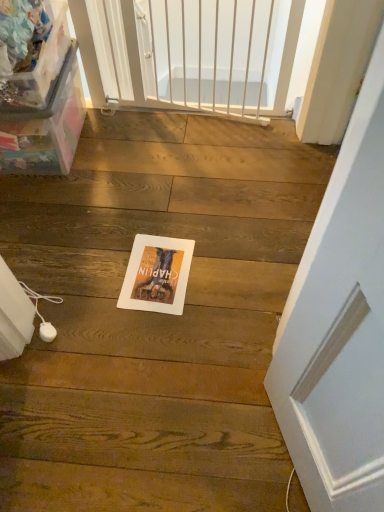
Question: Does transparent plastic box at left have a smaller size compared to matte paper postcard at center?

Choices:
 (A) yes
 (B) no

Answer: (B)

Question: Is the surface of transparent plastic box at left in direct contact with matte paper postcard at center?

Choices:
 (A) yes
 (B) no

Answer: (B)

Question: Considering the relative sizes of transparent plastic box at left and matte paper postcard at center in the image provided, is transparent plastic box at left wider than matte paper postcard at center?

Choices:
 (A) yes
 (B) no

Answer: (A)

Question: Could you tell me if transparent plastic box at left is turned towards matte paper postcard at center?

Choices:
 (A) yes
 (B) no

Answer: (B)

Question: From the image's perspective, is transparent plastic box at left over matte paper postcard at center?

Choices:
 (A) yes
 (B) no

Answer: (A)

Question: From a real-world perspective, is transparent plastic box at left located beneath matte paper postcard at center?

Choices:
 (A) yes
 (B) no

Answer: (B)

Question: Would you consider matte paper postcard at center to be distant from white metal gate at upper center?

Choices:
 (A) no
 (B) yes

Answer: (A)

Question: Does matte paper postcard at center appear on the right side of white metal gate at upper center?

Choices:
 (A) yes
 (B) no

Answer: (B)

Question: Can you confirm if matte paper postcard at center is bigger than white metal gate at upper center?

Choices:
 (A) no
 (B) yes

Answer: (A)

Question: Is matte paper postcard at center wider than white metal gate at upper center?

Choices:
 (A) no
 (B) yes

Answer: (B)

Question: From the image's perspective, is matte paper postcard at center below white metal gate at upper center?

Choices:
 (A) no
 (B) yes

Answer: (B)

Question: From a real-world perspective, is matte paper postcard at center located higher than white metal gate at upper center?

Choices:
 (A) no
 (B) yes

Answer: (A)

Question: Does white metal gate at upper center have a greater width compared to transparent plastic box at left?

Choices:
 (A) yes
 (B) no

Answer: (B)